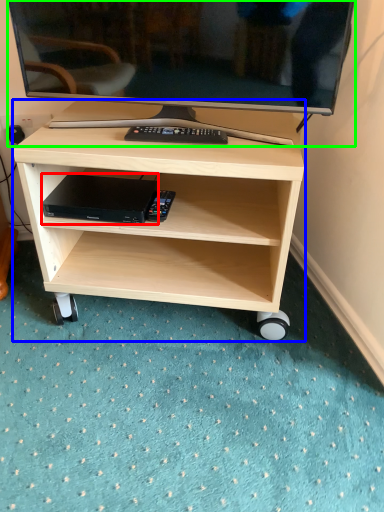
Question: Estimate the real-world distances between objects in this image. Which object is closer to computer (highlighted by a red box), desk (highlighted by a blue box) or television (highlighted by a green box)?

Choices:
 (A) desk
 (B) television

Answer: (A)